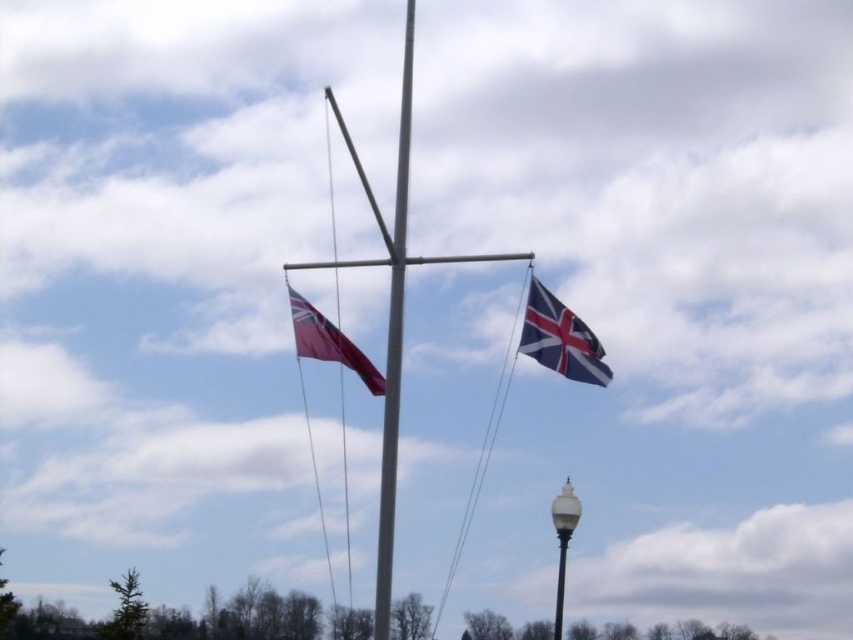
Question: Is metallic pole at center bigger than polished blue and white fabric flag at upper right?

Choices:
 (A) no
 (B) yes

Answer: (B)

Question: Is metallic pole at center positioned in front of metallic silver flag pole at center?

Choices:
 (A) yes
 (B) no

Answer: (A)

Question: Considering the real-world distances, which object is closest to the red matte flag at center?

Choices:
 (A) metallic pole at center
 (B) metallic silver flag pole at center
 (C) white glossy lamp post at center
 (D) polished blue and white fabric flag at upper right

Answer: (D)

Question: Based on their relative distances, which object is farther from the red matte flag at center?

Choices:
 (A) metallic pole at center
 (B) polished blue and white fabric flag at upper right
 (C) white glossy lamp post at center
 (D) metallic silver flag pole at center

Answer: (A)

Question: Which point is closer to the camera taking this photo?

Choices:
 (A) (592, 339)
 (B) (380, 480)

Answer: (A)

Question: Does metallic silver flag pole at center have a lesser width compared to red matte flag at center?

Choices:
 (A) no
 (B) yes

Answer: (A)